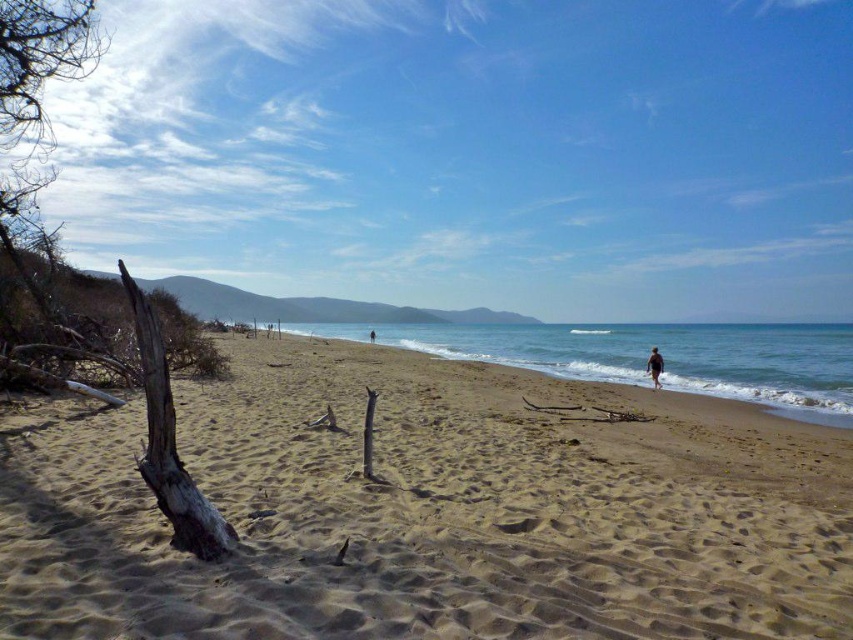
Where is the light brown sandy beach at center located in the image?

The light brown sandy beach at center is located at point (x=428, y=512) in the image.

You are standing on the brown sand at center and want to reach the blue water at beach right. Based on the scene description, which direction should you move to get to the water?

The blue water at beach right has a greater height compared to the brown sand at center, so you should move towards the beach right direction to reach the water.

You are standing at the center of the beach and want to walk to the blue water at beach right. Which direction should you head towards?

The blue water at beach right is located at point (648, 353), so you should head towards the right side of the beach to reach it.